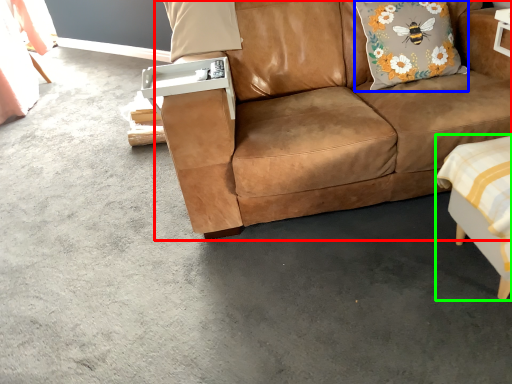
Question: Which object is the closest to the studio couch (highlighted by a red box)? Choose among these: pillow (highlighted by a blue box) or swivel chair (highlighted by a green box).

Choices:
 (A) pillow
 (B) swivel chair

Answer: (A)